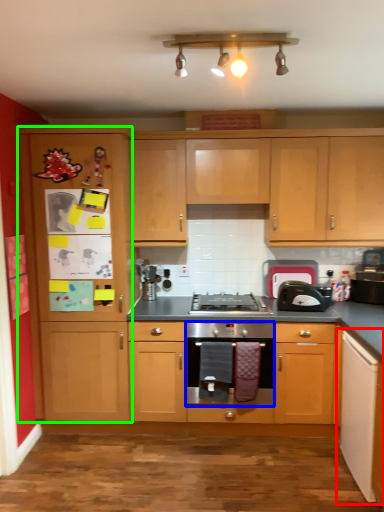
Question: Which object is positioned closest to cabinetry (highlighted by a red box)? Select from oven (highlighted by a blue box) and file cabinet (highlighted by a green box).

Choices:
 (A) oven
 (B) file cabinet

Answer: (A)